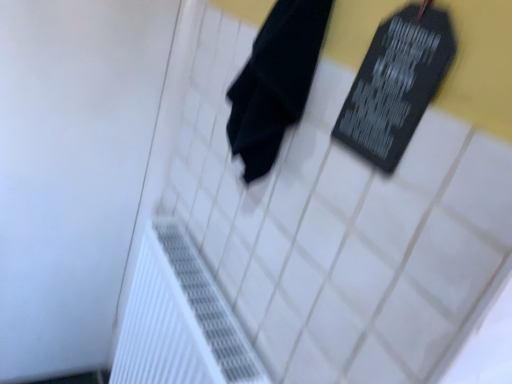
What is the approximate height of black matte towel at center?

14.94 inches.

At what (x,y) coordinates should I click in order to perform the action: click on white textured radiator at lower left. Please return your answer as a coordinate pair (x, y). This screenshot has height=384, width=512. Looking at the image, I should click on (179, 319).

Looking at their sizes, would you say black matte towel at center is wider or thinner than black matte board at upper right?

In the image, black matte towel at center appears to be wider than black matte board at upper right.

From the picture: Can you see black matte towel at center touching black matte board at upper right?

No, black matte towel at center is not in contact with black matte board at upper right.

From the image's perspective, is black matte towel at center located beneath black matte board at upper right?

Yes, from the image's perspective, black matte towel at center is beneath black matte board at upper right.

How many degrees apart are the facing directions of black matte towel at center and black matte board at upper right?

The angle between the facing direction of black matte towel at center and the facing direction of black matte board at upper right is 0.968 degrees.

Does black matte board at upper right turn towards white textured radiator at lower left?

No, black matte board at upper right is not facing towards white textured radiator at lower left.

Between point (337, 130) and point (140, 251), which one is positioned in front?

Positioned in front is point (337, 130).

Considering the relative sizes of black matte board at upper right and white textured radiator at lower left in the image provided, is black matte board at upper right shorter than white textured radiator at lower left?

Correct, black matte board at upper right is not as tall as white textured radiator at lower left.

Is black matte board at upper right next to white textured radiator at lower left?

black matte board at upper right and white textured radiator at lower left are not in contact.

From the image's perspective, does black matte towel at center appear lower than white textured radiator at lower left?

No.

Locate an element on the screen. This screenshot has height=384, width=512. towel above the white textured radiator at lower left (from a real-world perspective) is located at coordinates (275, 82).

Does black matte towel at center have a smaller size compared to white textured radiator at lower left?

Yes.

Which object is wider, white textured radiator at lower left or black matte towel at center?

Wider between the two is white textured radiator at lower left.

In the scene shown: Is white textured radiator at lower left next to black matte towel at center?

white textured radiator at lower left and black matte towel at center are not in contact.

Is white textured radiator at lower left aimed at black matte towel at center?

No, white textured radiator at lower left is not turned towards black matte towel at center.

Is black matte towel at center a part of white textured radiator at lower left?

No.

From the picture: From a real-world perspective, is white textured radiator at lower left physically located above or below black matte board at upper right?

From a real-world perspective, white textured radiator at lower left is physically below black matte board at upper right.

From the picture: Does white textured radiator at lower left have a greater width compared to black matte board at upper right?

Yes, white textured radiator at lower left is wider than black matte board at upper right.

From the image's perspective, is white textured radiator at lower left above or below black matte board at upper right?

From the image's perspective, white textured radiator at lower left appears below black matte board at upper right.

Does point (207, 356) appear closer or farther from the camera than point (416, 25)?

Clearly, point (207, 356) is more distant from the camera than point (416, 25).

The height and width of the screenshot is (384, 512). Find the location of `bulletin board in front of the black matte towel at center`. bulletin board in front of the black matte towel at center is located at coordinates (396, 84).

Between black matte board at upper right and black matte towel at center, which one has smaller size?

With smaller size is black matte board at upper right.

Is the depth of black matte board at upper right less than that of black matte towel at center?

Result: Yes, black matte board at upper right is closer to the viewer.

From a real-world perspective, who is located lower, black matte board at upper right or black matte towel at center?

black matte towel at center.

Where is `bulletin board located above the black matte towel at center (from a real-world perspective)`? This screenshot has width=512, height=384. bulletin board located above the black matte towel at center (from a real-world perspective) is located at coordinates (396, 84).

Find the location of `radiator on the left side of black matte board at upper right`. radiator on the left side of black matte board at upper right is located at coordinates point(179,319).

In the scene shown: When comparing their distances from black matte towel at center, does white textured radiator at lower left or black matte board at upper right seem further?

Result: Among the two, white textured radiator at lower left is located further to black matte towel at center.

When comparing their distances from black matte towel at center, does black matte board at upper right or white textured radiator at lower left seem closer?

Based on the image, black matte board at upper right appears to be nearer to black matte towel at center.

Based on their spatial positions, is black matte board at upper right or black matte towel at center further from white textured radiator at lower left?

black matte board at upper right.

Considering their positions, is black matte towel at center positioned closer to black matte board at upper right than white textured radiator at lower left?

The object closer to black matte board at upper right is black matte towel at center.

In the scene shown: Based on their spatial positions, is black matte towel at center or black matte board at upper right further from white textured radiator at lower left?

The object further to white textured radiator at lower left is black matte board at upper right.

Considering their positions, is white textured radiator at lower left positioned closer to black matte board at upper right than black matte towel at center?

Among the two, black matte towel at center is located nearer to black matte board at upper right.

Locate an element on the screen. towel that lies between black matte board at upper right and white textured radiator at lower left from top to bottom is located at coordinates (275, 82).